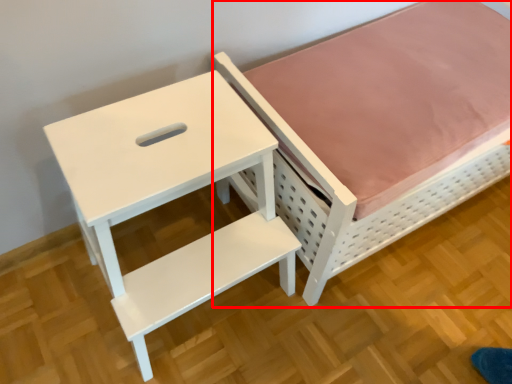
Question: From the image's perspective, what is the correct spatial positioning of furniture (annotated by the red box) in reference to table?

Choices:
 (A) above
 (B) below

Answer: (A)